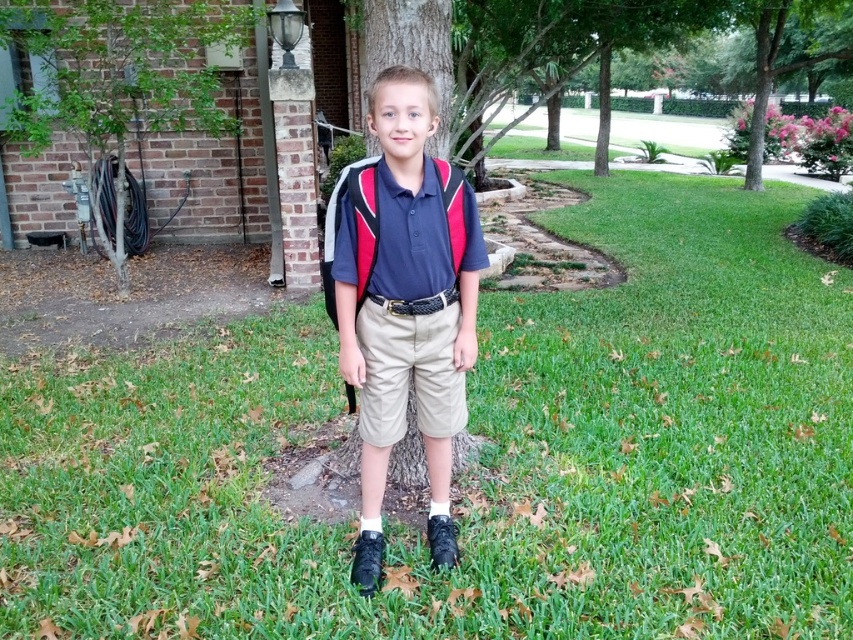
Question: Does green grass at center appear on the left side of green leafy tree at left?

Choices:
 (A) no
 (B) yes

Answer: (A)

Question: Which point is closer to the camera?

Choices:
 (A) khaki cotton shorts at center
 (B) green leafy tree at left

Answer: (A)

Question: Which object is the farthest from the matte blue shirt at center?

Choices:
 (A) green grass at center
 (B) khaki cotton shorts at center

Answer: (A)

Question: Does green grass at center have a larger size compared to green leafy tree at left?

Choices:
 (A) yes
 (B) no

Answer: (B)

Question: Does green grass at center have a larger size compared to green leafy tree at left?

Choices:
 (A) yes
 (B) no

Answer: (B)

Question: Among these objects, which one is nearest to the camera?

Choices:
 (A) green leafy tree at left
 (B) green grass at center

Answer: (B)